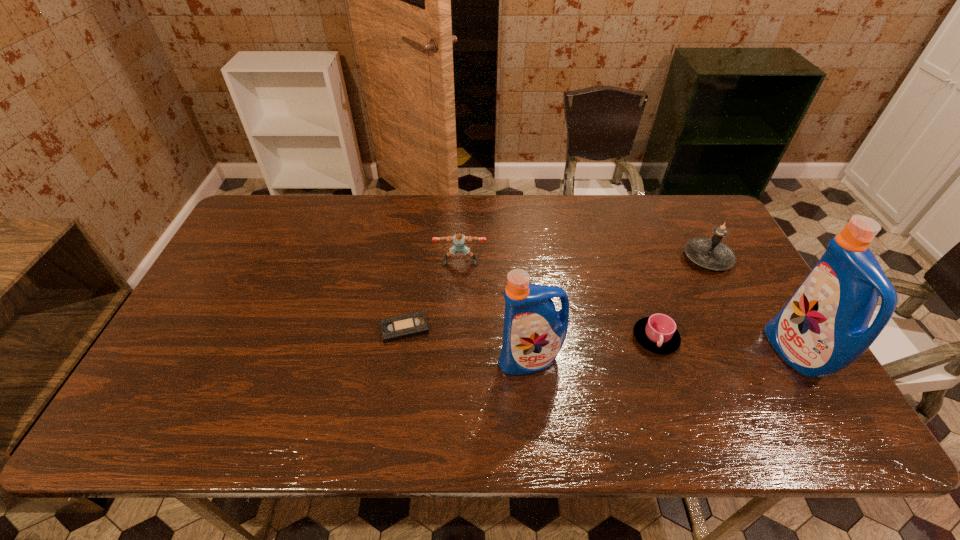
You are a GUI agent. You are given a task and a screenshot of the screen. Output one action in this format:
    pyautogui.click(x=<x>, y=<y>)
    Task: Click on the third object from left to right
    
    Given the screenshot: What is the action you would take?
    pyautogui.click(x=534, y=332)

Identify the location of the left detergent. (534, 332).

Locate an element on the screen. This screenshot has height=540, width=960. the right detergent is located at coordinates (823, 328).

Find the location of a particular element. the tallest object is located at coordinates (823, 328).

Where is `candle`? The image size is (960, 540). candle is located at coordinates (711, 253).

At what (x,y) coordinates should I click in order to perform the action: click on the fourth tallest object. Please return your answer as a coordinate pair (x, y). The width and height of the screenshot is (960, 540). Looking at the image, I should click on (459, 240).

At what (x,y) coordinates should I click in order to perform the action: click on videotape. Please return your answer as a coordinate pair (x, y). The width and height of the screenshot is (960, 540). Looking at the image, I should click on (410, 325).

You are a GUI agent. You are given a task and a screenshot of the screen. Output one action in this format:
    pyautogui.click(x=<x>, y=<y>)
    Task: Click on the cup
    
    Given the screenshot: What is the action you would take?
    tap(657, 333)

This screenshot has width=960, height=540. Identify the location of the third object from right to left. (657, 333).

What are the coordinates of `vacant space located on the label of the taller detergent` in the screenshot? It's located at (667, 354).